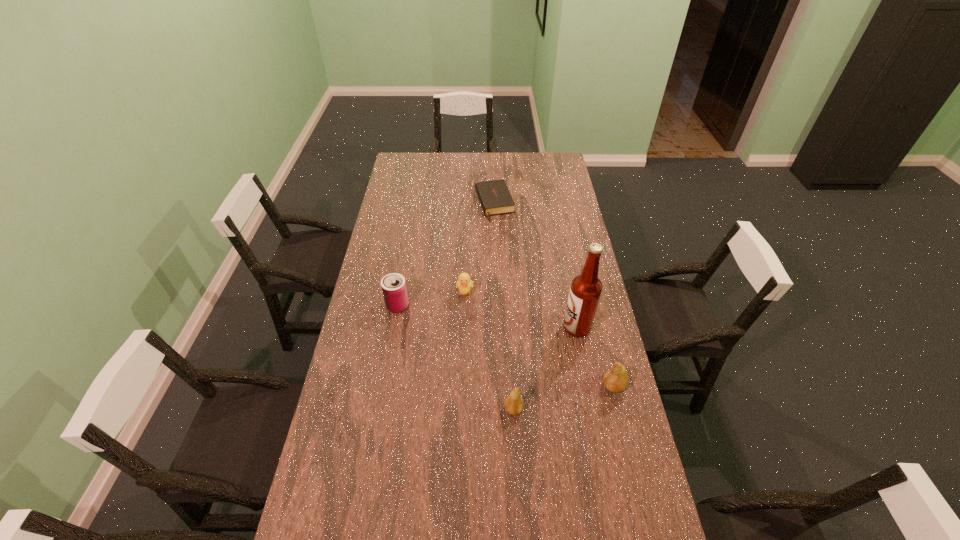
Find the location of a particular element. This screenshot has width=960, height=540. alcohol at the right edge is located at coordinates (586, 288).

The width and height of the screenshot is (960, 540). In order to click on vacant space at the far edge of the desktop in this screenshot , I will do `click(447, 159)`.

This screenshot has width=960, height=540. In the image, there is a desktop. In order to click on vacant region at the left edge in this screenshot , I will do `click(407, 258)`.

Find the location of a particular element. free space at the right edge of the desktop is located at coordinates (578, 252).

Identify the location of free space at the far left corner of the desktop. (410, 165).

Identify the location of vacant area at the near right corner. The width and height of the screenshot is (960, 540). (634, 517).

You are a GUI agent. You are given a task and a screenshot of the screen. Output one action in this format:
    pyautogui.click(x=<x>, y=<y>)
    Task: Click on the vacant area that lies between the taller pear and the can
    The height and width of the screenshot is (540, 960).
    Given the screenshot: What is the action you would take?
    pyautogui.click(x=505, y=346)

Locate an element on the screen. empty location between the alcohol and the leftmost object is located at coordinates (488, 316).

Find the location of a particular element. Image resolution: width=960 pixels, height=540 pixels. free spot between the shorter pear and the can is located at coordinates (456, 357).

Locate an element on the screen. free space between the duckling and the nearer pear is located at coordinates (490, 352).